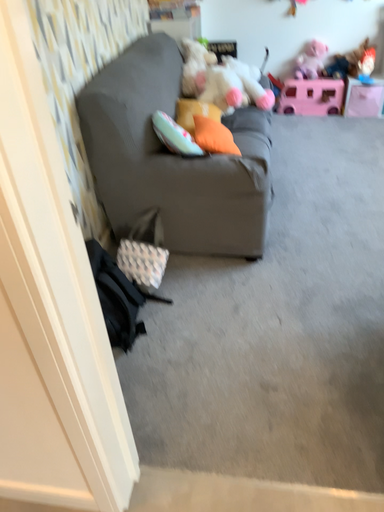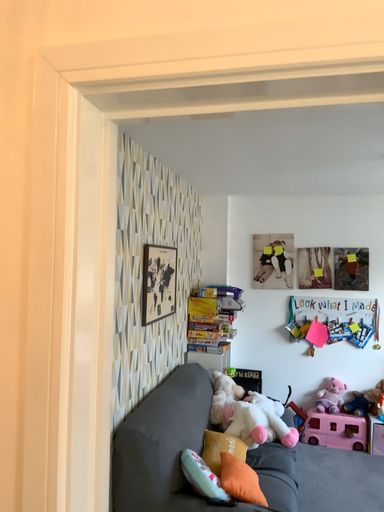
Question: Which way did the camera rotate in the video?

Choices:
 (A) rotated upward
 (B) rotated downward

Answer: (A)